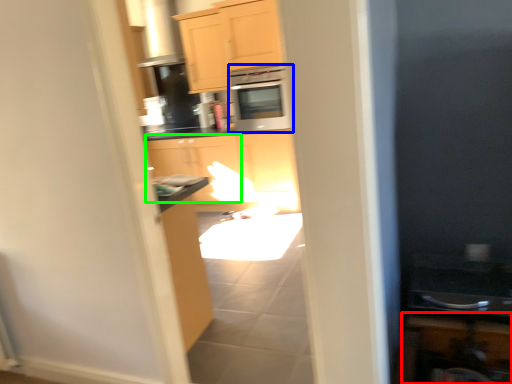
Question: Estimate the real-world distances between objects in this image. Which object is closer to cabinetry (highlighted by a red box), microwave oven (highlighted by a blue box) or cabinetry (highlighted by a green box)?

Choices:
 (A) microwave oven
 (B) cabinetry

Answer: (B)